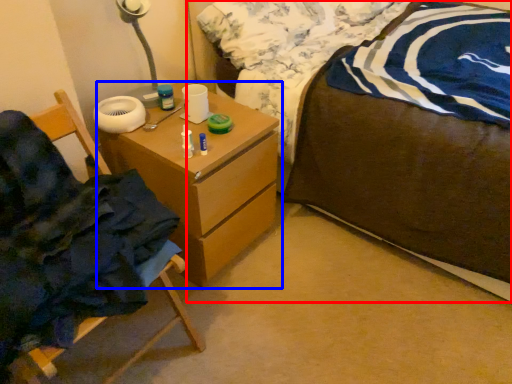
Question: Which object is further to the camera taking this photo, bed (highlighted by a red box) or chest of drawers (highlighted by a blue box)?

Choices:
 (A) bed
 (B) chest of drawers

Answer: (B)